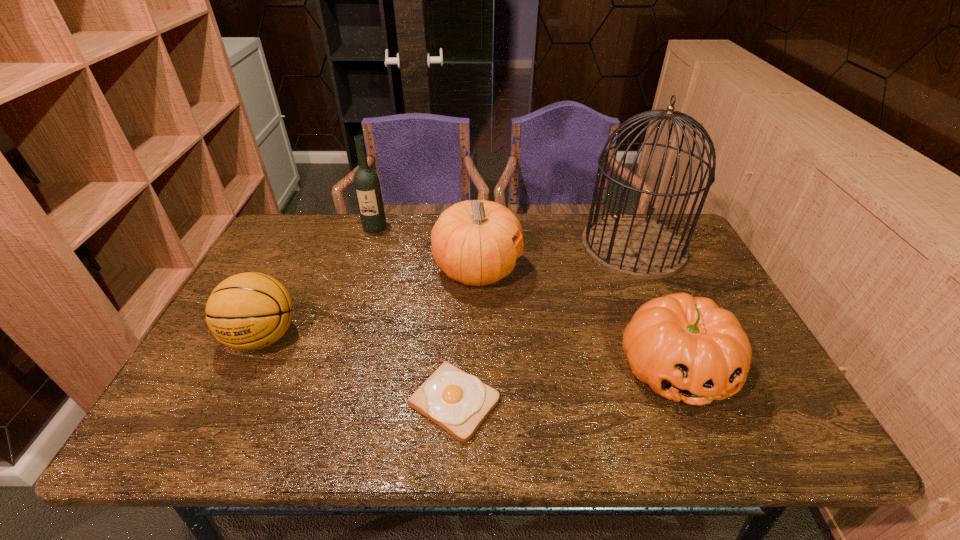
You are a GUI agent. You are given a task and a screenshot of the screen. Output one action in this format:
    pyautogui.click(x=<x>, y=<y>)
    Task: Click on the vacant point located on the labeled side of the wine bottle
    
    Given the screenshot: What is the action you would take?
    pyautogui.click(x=363, y=266)

The width and height of the screenshot is (960, 540). I want to click on vacant space situated 0.230m on the front-facing side of the left pumpkin, so click(x=599, y=270).

The image size is (960, 540). In order to click on vacant region located on the surface of the leftmost object near the brand logo in this screenshot , I will do `click(214, 438)`.

The height and width of the screenshot is (540, 960). I want to click on vacant area located 0.090m on the left of the toast, so tap(368, 402).

The height and width of the screenshot is (540, 960). In order to click on birdcage that is at the far edge in this screenshot , I will do `click(637, 247)`.

The image size is (960, 540). I want to click on wine bottle present at the far edge, so (x=367, y=187).

Image resolution: width=960 pixels, height=540 pixels. I want to click on pumpkin situated at the far edge, so click(x=471, y=241).

This screenshot has width=960, height=540. I want to click on pumpkin at the near edge, so click(x=686, y=348).

I want to click on toast present at the near edge, so click(x=459, y=402).

Where is `object located at the left edge`? This screenshot has height=540, width=960. object located at the left edge is located at coordinates (248, 311).